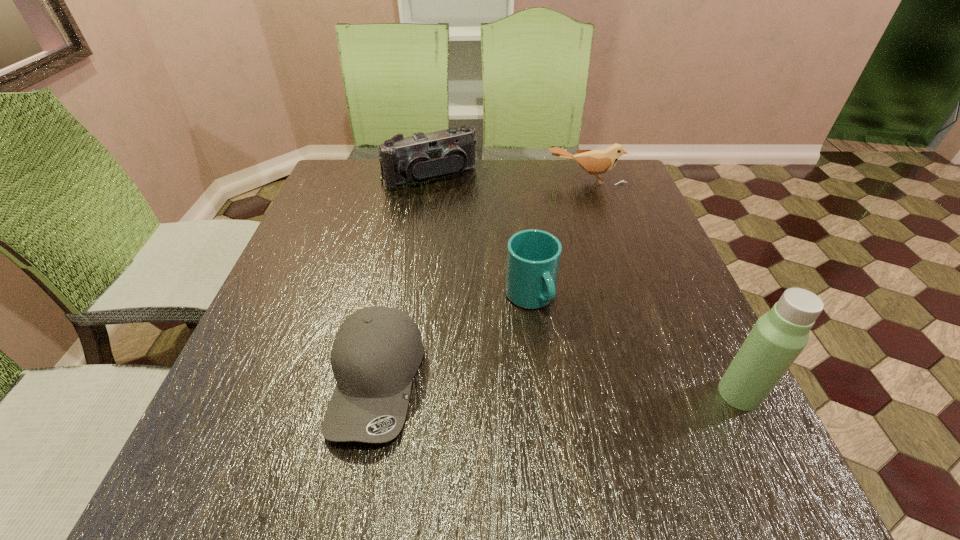
You are a GUI agent. You are given a task and a screenshot of the screen. Output one action in this format:
    pyautogui.click(x=<x>, y=<y>)
    Task: Click on the vacant space on the desktop that is between the baseball cap and the thermos bottle and is positioned on the front-facing side of the camcorder
    The width and height of the screenshot is (960, 540).
    Given the screenshot: What is the action you would take?
    (572, 388)

Identify the location of free spot on the desktop that is between the baseball cap and the thermos bottle and is positioned at the beak of the bird. This screenshot has width=960, height=540. (579, 388).

Where is `free space on the desktop that is between the baseball cap and the thermos bottle and is positioned on the handle side of the cup`? This screenshot has width=960, height=540. free space on the desktop that is between the baseball cap and the thermos bottle and is positioned on the handle side of the cup is located at coordinates click(x=591, y=388).